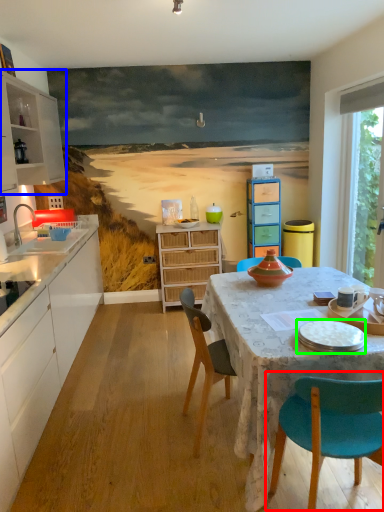
Question: Based on their relative distances, which object is nearer to chair (highlighted by a red box)? Choose from cabinetry (highlighted by a blue box) and tableware (highlighted by a green box).

Choices:
 (A) cabinetry
 (B) tableware

Answer: (B)